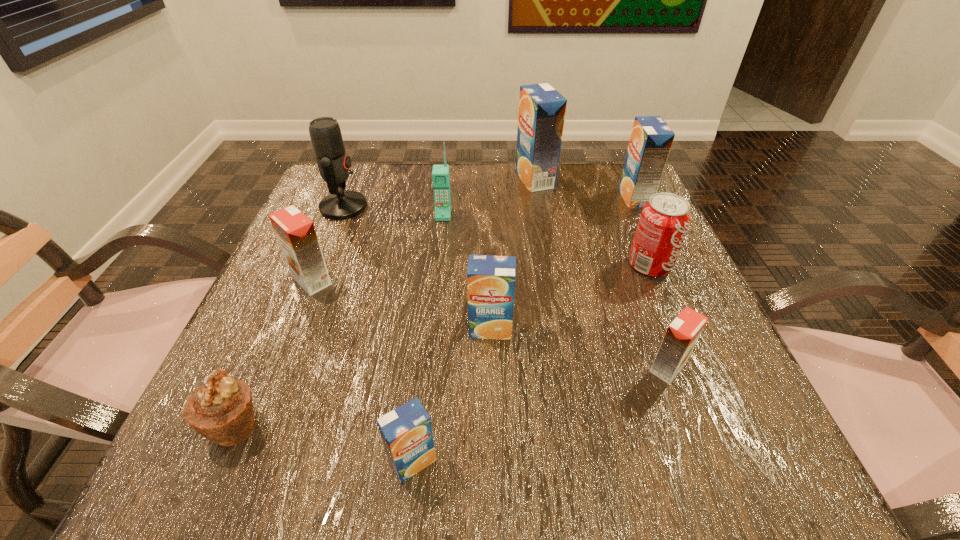
At what (x,y) coordinates should I click in order to perform the action: click on vacant region located on the back of the soda. Please return your answer as a coordinate pair (x, y). The width and height of the screenshot is (960, 540). Looking at the image, I should click on (621, 200).

This screenshot has height=540, width=960. In order to click on vacant area situated 0.280m on the back of the third farthest orange_juice in this screenshot , I will do `click(348, 190)`.

Where is `vacant space located 0.170m on the front of the second smallest blue orange_juice`? The height and width of the screenshot is (540, 960). vacant space located 0.170m on the front of the second smallest blue orange_juice is located at coordinates (492, 436).

You are a GUI agent. You are given a task and a screenshot of the screen. Output one action in this format:
    pyautogui.click(x=<x>, y=<y>)
    Task: Click on the free space located 0.220m on the back of the muffin
    
    Given the screenshot: What is the action you would take?
    pyautogui.click(x=292, y=295)

Find the location of a particular element. Image resolution: width=960 pixels, height=540 pixels. free space located on the left of the smaller orange orange juice is located at coordinates (424, 368).

This screenshot has height=540, width=960. Find the location of `free space located on the left of the nearest orange_juice`. free space located on the left of the nearest orange_juice is located at coordinates (268, 461).

Image resolution: width=960 pixels, height=540 pixels. I want to click on microphone located in the far edge section of the desktop, so click(333, 163).

You are a GUI agent. You are given a task and a screenshot of the screen. Output one action in this format:
    pyautogui.click(x=<x>, y=<y>)
    Task: Click on the cellular telephone located in the far edge section of the desktop
    The width and height of the screenshot is (960, 540).
    Given the screenshot: What is the action you would take?
    pyautogui.click(x=440, y=173)

Find the location of a particular element. muffin located at the near edge is located at coordinates click(221, 410).

Locate an element on the screen. orange_juice that is at the near edge is located at coordinates (406, 431).